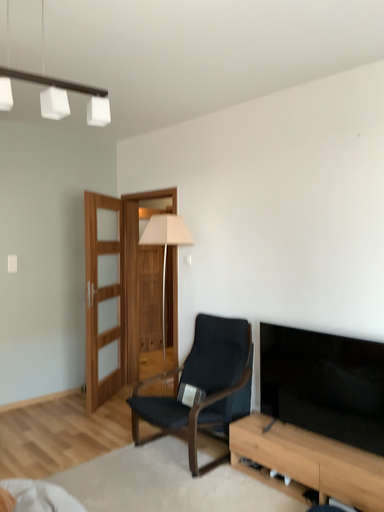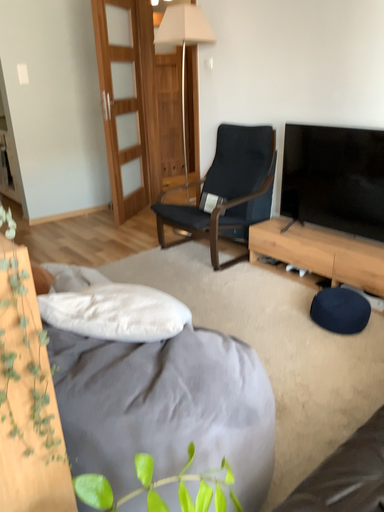
Question: How did the camera likely rotate when shooting the video?

Choices:
 (A) rotated upward
 (B) rotated downward

Answer: (B)